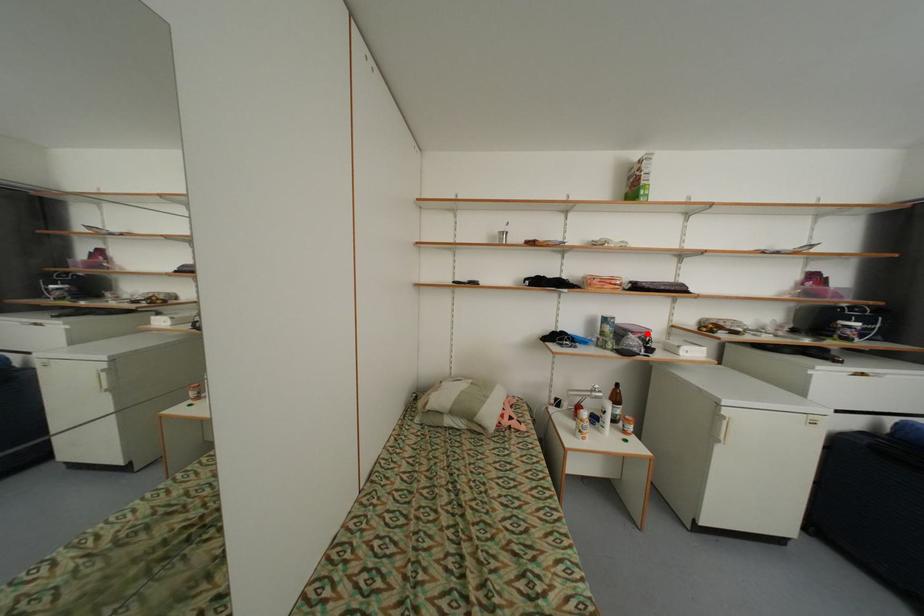
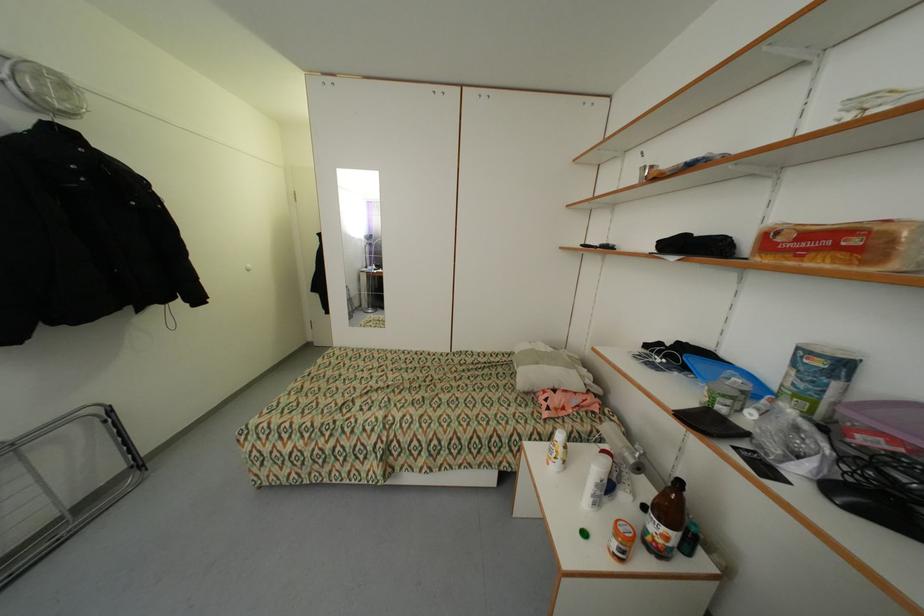
In the second image, find the point that corresponds to the highlighted location in the first image.

(900, 440)